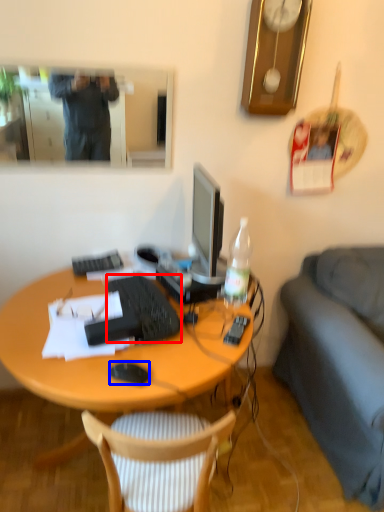
Question: Which point is further to the camera, computer keyboard (highlighted by a red box) or computer mouse (highlighted by a blue box)?

Choices:
 (A) computer keyboard
 (B) computer mouse

Answer: (A)